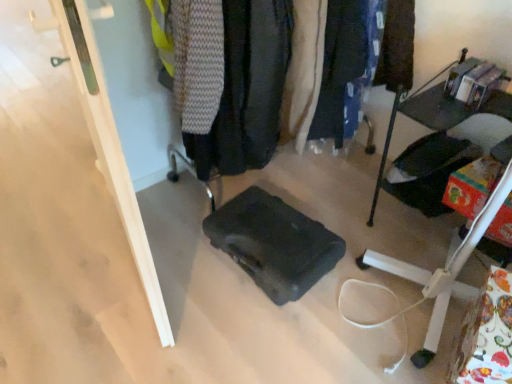
Question: Is black matte suitcase at center taller than dark blue fabric pants at center, which is the 1th clothing from right to left?

Choices:
 (A) no
 (B) yes

Answer: (A)

Question: Does black matte suitcase at center appear on the right side of dark blue fabric pants at center, which is the 1th clothing from right to left?

Choices:
 (A) no
 (B) yes

Answer: (A)

Question: From a real-world perspective, does black matte suitcase at center sit lower than dark blue fabric pants at center, which is the 1th clothing from right to left?

Choices:
 (A) yes
 (B) no

Answer: (A)

Question: Is dark blue fabric pants at center, which is the 1th clothing from right to left, completely or partially inside black matte suitcase at center?

Choices:
 (A) yes
 (B) no

Answer: (B)

Question: Is black matte suitcase at center facing away from dark blue fabric pants at center, positioned as the 2th clothing in left-to-right order?

Choices:
 (A) no
 (B) yes

Answer: (A)

Question: Does black matte suitcase at center come behind dark blue fabric pants at center, which is the 1th clothing from right to left?

Choices:
 (A) yes
 (B) no

Answer: (B)

Question: Considering the relative sizes of dark gray fabric jacket at center, which appears as the 1th clothing when viewed from the left, and dark blue fabric pants at center, positioned as the 2th clothing in left-to-right order, in the image provided, is dark gray fabric jacket at center, which appears as the 1th clothing when viewed from the left, bigger than dark blue fabric pants at center, positioned as the 2th clothing in left-to-right order,?

Choices:
 (A) no
 (B) yes

Answer: (B)

Question: Would you say dark gray fabric jacket at center, placed as the second clothing when sorted from right to left, is a long distance from dark blue fabric pants at center, positioned as the 2th clothing in left-to-right order?

Choices:
 (A) no
 (B) yes

Answer: (A)

Question: From the image's perspective, does dark gray fabric jacket at center, which appears as the 1th clothing when viewed from the left, appear higher than dark blue fabric pants at center, which is the 1th clothing from right to left?

Choices:
 (A) yes
 (B) no

Answer: (B)

Question: Can you confirm if dark gray fabric jacket at center, placed as the second clothing when sorted from right to left, is smaller than dark blue fabric pants at center, positioned as the 2th clothing in left-to-right order?

Choices:
 (A) no
 (B) yes

Answer: (A)

Question: Is dark gray fabric jacket at center, placed as the second clothing when sorted from right to left, not inside dark blue fabric pants at center, which is the 1th clothing from right to left?

Choices:
 (A) yes
 (B) no

Answer: (A)

Question: Is dark gray fabric jacket at center, which appears as the 1th clothing when viewed from the left, closer to camera compared to dark blue fabric pants at center, positioned as the 2th clothing in left-to-right order?

Choices:
 (A) no
 (B) yes

Answer: (B)

Question: Can you see black matte suitcase at center touching dark gray fabric at center?

Choices:
 (A) yes
 (B) no

Answer: (B)